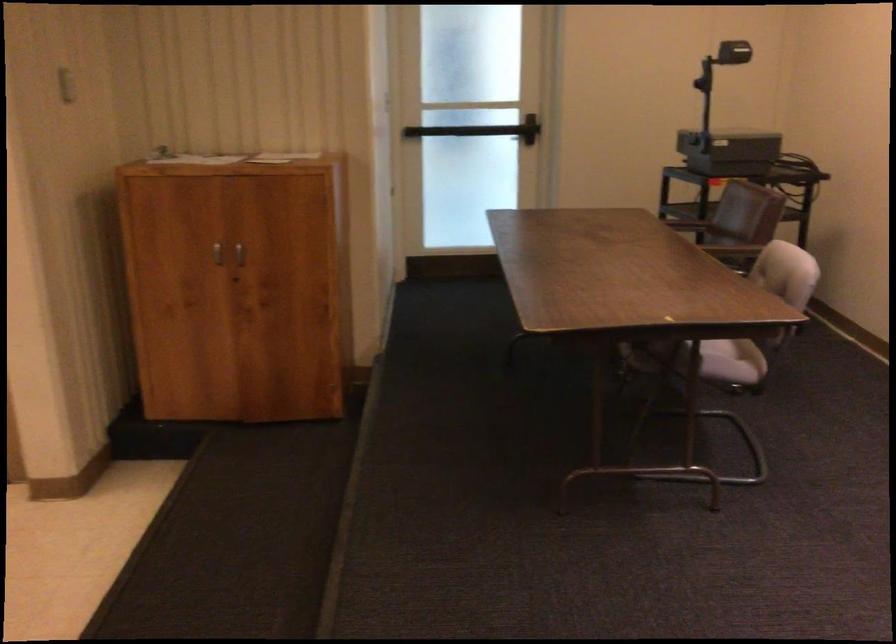
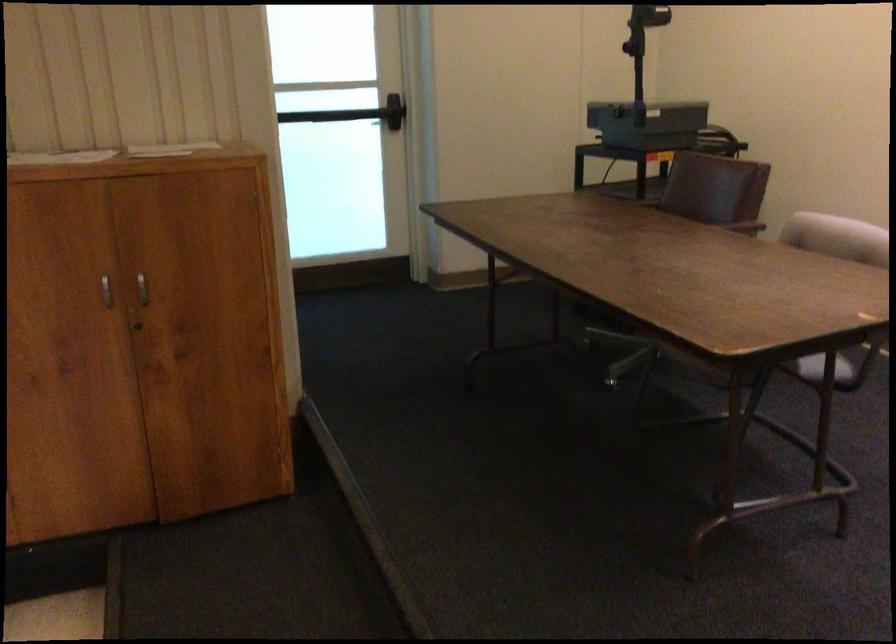
Locate, in the second image, the point that corresponds to (x=213, y=251) in the first image.

(106, 290)